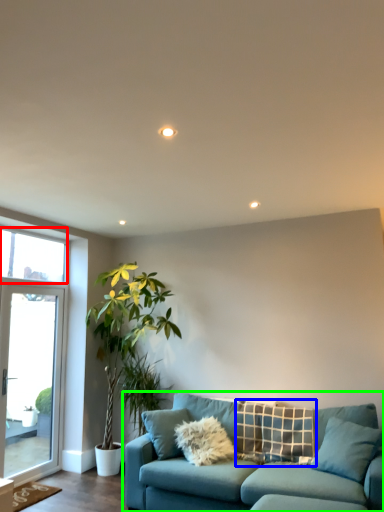
Question: Which object is the farthest from window screen (highlighted by a red box)? Choose among these: pillow (highlighted by a blue box) or studio couch (highlighted by a green box).

Choices:
 (A) pillow
 (B) studio couch

Answer: (A)